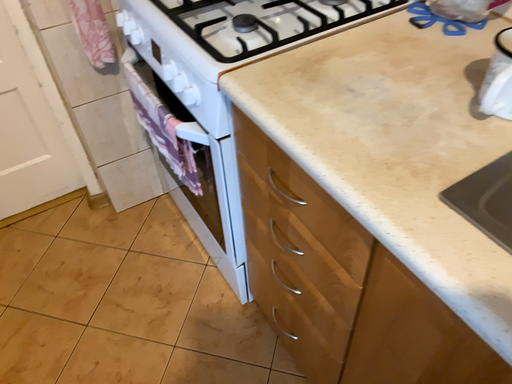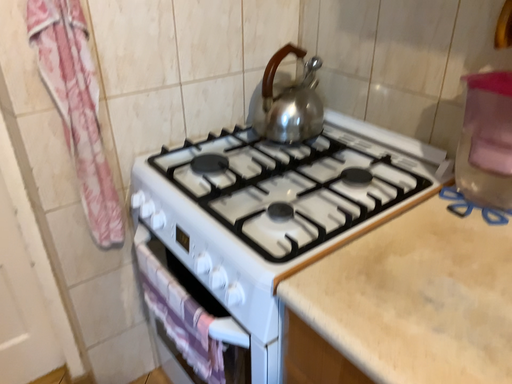
Question: Which way did the camera rotate in the video?

Choices:
 (A) rotated upward
 (B) rotated downward

Answer: (A)